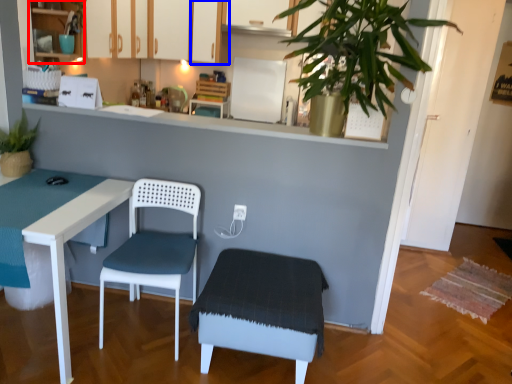
Question: Which of the following is the closest to the observer, cabinetry (highlighted by a red box) or cabinetry (highlighted by a blue box)?

Choices:
 (A) cabinetry
 (B) cabinetry

Answer: (A)